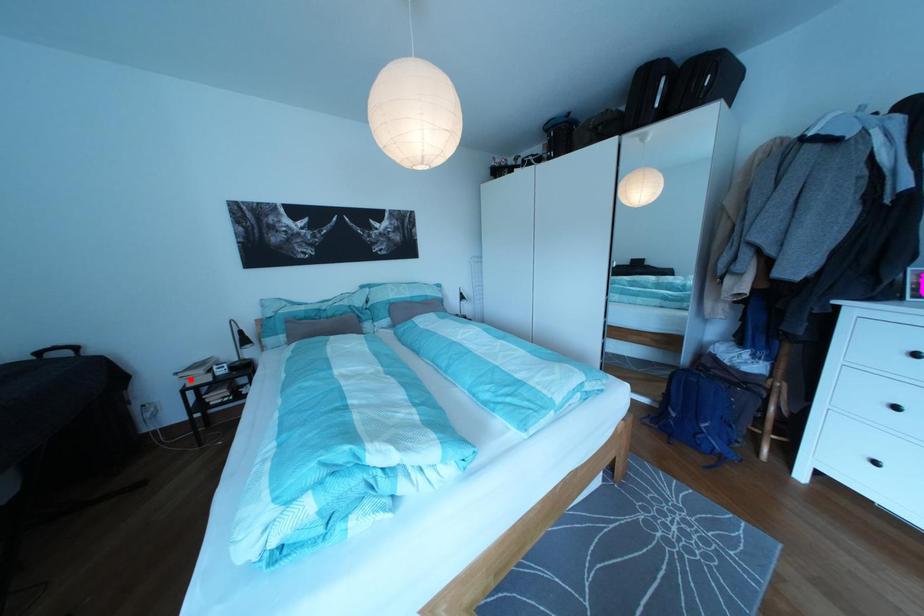
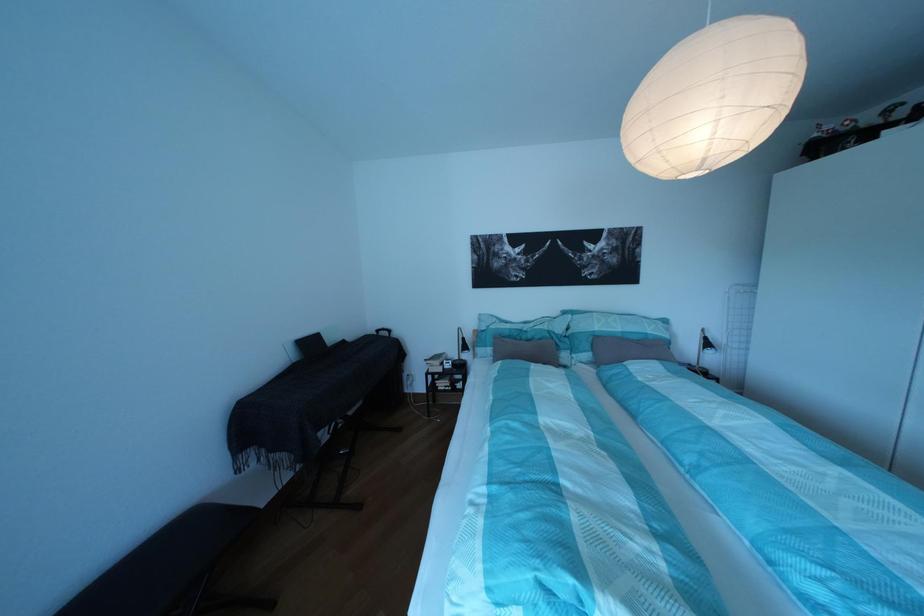
The point at the highlighted location is marked in the first image. Where is the corresponding point in the second image?

(439, 367)